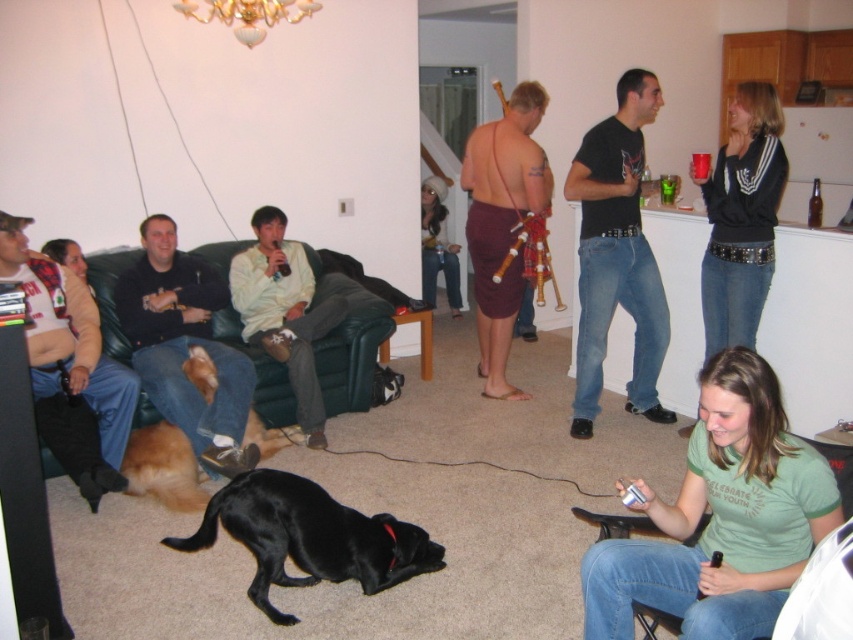
You are standing in the living room and want to move from the brown fur dog at lower left to the green leather couch at left. Which direction should you move to reach the couch?

To reach the green leather couch at left from the brown fur dog at lower left, you should move to the right since the green leather couch at left is positioned to the right of the brown fur dog at lower left.

You are at a party and want to greet the person wearing the flannel shirt at left and the person wearing the light yellow shirt at center. Which one can you see more clearly if you are standing in front of the group?

The flannel shirt at left is in front of the light yellow shirt at center, so you can see the flannel shirt at left more clearly.